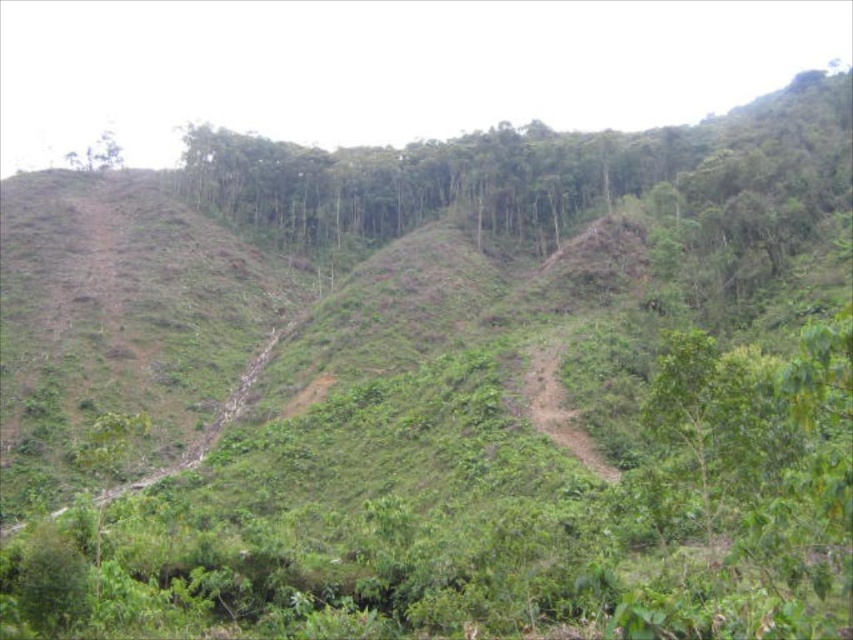
Question: From the image, what is the correct spatial relationship of brown dirt track at center in relation to green leafy tree at upper left?

Choices:
 (A) above
 (B) below

Answer: (B)

Question: Which object appears closest to the camera in this image?

Choices:
 (A) brown dirt track at center
 (B) green leafy tree at upper left

Answer: (A)

Question: Where is brown dirt track at center located in relation to green leafy tree at upper left in the image?

Choices:
 (A) above
 (B) below

Answer: (B)

Question: Does brown dirt track at center have a smaller size compared to green leafy tree at upper left?

Choices:
 (A) yes
 (B) no

Answer: (A)

Question: Among these points, which one is nearest to the camera?

Choices:
 (A) (74, 152)
 (B) (537, 369)

Answer: (B)